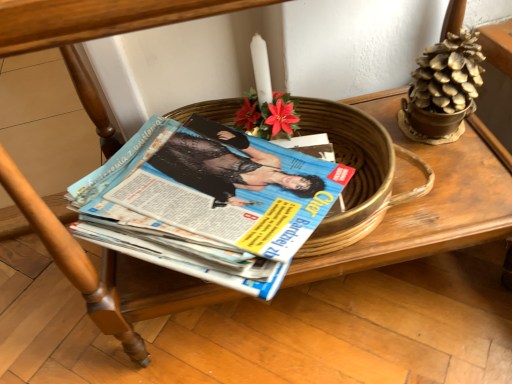
This screenshot has width=512, height=384. Describe the element at coordinates (443, 90) in the screenshot. I see `gold metallic pinecone at upper right` at that location.

In order to click on gold metallic flowerpot at upper right in this screenshot , I will do `click(432, 123)`.

Which is behind, blue glossy magazine at center or gold metallic pinecone at upper right?

Positioned behind is gold metallic pinecone at upper right.

Is there a large distance between blue glossy magazine at center and gold metallic pinecone at upper right?

They are positioned close to each other.

Looking at their sizes, would you say blue glossy magazine at center is wider or thinner than gold metallic pinecone at upper right?

blue glossy magazine at center is wider than gold metallic pinecone at upper right.

Would you say gold metallic pinecone at upper right is outside blue glossy magazine at center?

Absolutely, gold metallic pinecone at upper right is external to blue glossy magazine at center.

From the image's perspective, is gold metallic pinecone at upper right on top of blue glossy magazine at center?

Correct, gold metallic pinecone at upper right appears higher than blue glossy magazine at center in the image.

Can you confirm if gold metallic pinecone at upper right is positioned to the left of blue glossy magazine at center?

No.

Considering the sizes of objects gold metallic pinecone at upper right and blue glossy magazine at center in the image provided, who is thinner, gold metallic pinecone at upper right or blue glossy magazine at center?

Thinner between the two is gold metallic pinecone at upper right.

From the image's perspective, between gold metallic pinecone at upper right and gold metallic flowerpot at upper right, who is located below?

gold metallic flowerpot at upper right is shown below in the image.

Does gold metallic pinecone at upper right have a larger size compared to gold metallic flowerpot at upper right?

Indeed, gold metallic pinecone at upper right has a larger size compared to gold metallic flowerpot at upper right.

Which is less distant, [463,97] or [425,139]?

Positioned in front is point [463,97].

Between point (259, 205) and point (429, 135), which one is positioned in front?

Point (259, 205)

Measure the distance between blue glossy magazine at center and gold metallic flowerpot at upper right.

13.90 inches.

Considering the positions of objects blue glossy magazine at center and gold metallic flowerpot at upper right in the image provided, who is more to the left, blue glossy magazine at center or gold metallic flowerpot at upper right?

Positioned to the left is blue glossy magazine at center.

Considering the relative sizes of blue glossy magazine at center and gold metallic flowerpot at upper right in the image provided, is blue glossy magazine at center bigger than gold metallic flowerpot at upper right?

Indeed, blue glossy magazine at center has a larger size compared to gold metallic flowerpot at upper right.

Can you tell me how much gold metallic flowerpot at upper right and blue glossy magazine at center differ in facing direction?

33.6 degrees.

From the image's perspective, would you say gold metallic flowerpot at upper right is positioned over blue glossy magazine at center?

Yes.

Which object is thinner, gold metallic flowerpot at upper right or blue glossy magazine at center?

Thinner between the two is gold metallic flowerpot at upper right.

Considering the sizes of objects gold metallic flowerpot at upper right and gold metallic pinecone at upper right in the image provided, who is shorter, gold metallic flowerpot at upper right or gold metallic pinecone at upper right?

gold metallic flowerpot at upper right.

What's the angular difference between gold metallic flowerpot at upper right and gold metallic pinecone at upper right's facing directions?

They differ by 0.00151 degrees in their facing directions.

From a real-world perspective, between gold metallic flowerpot at upper right and gold metallic pinecone at upper right, who is vertically higher?

gold metallic pinecone at upper right.

Locate an element on the screen. The image size is (512, 384). flower basket above the blue glossy magazine at center (from the image's perspective) is located at coordinates (443, 90).

Locate an element on the screen. Image resolution: width=512 pixels, height=384 pixels. flower basket behind the blue glossy magazine at center is located at coordinates (443, 90).

Looking at the image, which one is located further to gold metallic pinecone at upper right, gold metallic flowerpot at upper right or blue glossy magazine at center?

blue glossy magazine at center is positioned further to the anchor gold metallic pinecone at upper right.

Looking at the image, which one is located closer to gold metallic flowerpot at upper right, gold metallic pinecone at upper right or blue glossy magazine at center?

Based on the image, gold metallic pinecone at upper right appears to be nearer to gold metallic flowerpot at upper right.

Considering their positions, is blue glossy magazine at center positioned closer to gold metallic pinecone at upper right than gold metallic flowerpot at upper right?

The object closer to gold metallic pinecone at upper right is gold metallic flowerpot at upper right.

Which object lies nearer to the anchor point gold metallic flowerpot at upper right, blue glossy magazine at center or gold metallic pinecone at upper right?

Based on the image, gold metallic pinecone at upper right appears to be nearer to gold metallic flowerpot at upper right.

Which object lies nearer to the anchor point blue glossy magazine at center, gold metallic flowerpot at upper right or gold metallic pinecone at upper right?

gold metallic pinecone at upper right is closer to blue glossy magazine at center.

When comparing their distances from blue glossy magazine at center, does gold metallic pinecone at upper right or gold metallic flowerpot at upper right seem further?

The object further to blue glossy magazine at center is gold metallic flowerpot at upper right.

What are the coordinates of `flower basket located between blue glossy magazine at center and gold metallic flowerpot at upper right in the left-right direction` in the screenshot? It's located at (443, 90).